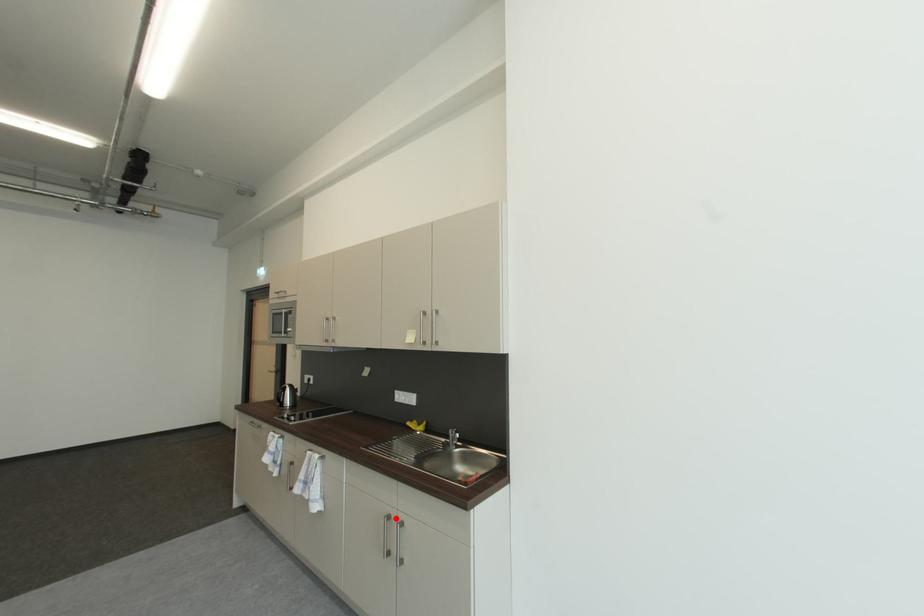
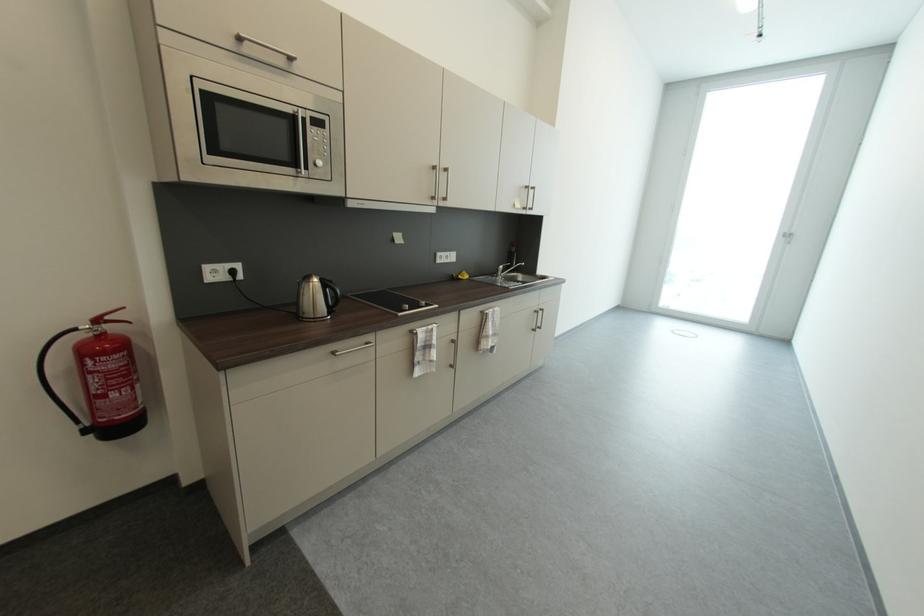
Where in the second image is the point corresponding to the highlighted location from the first image?

(541, 313)